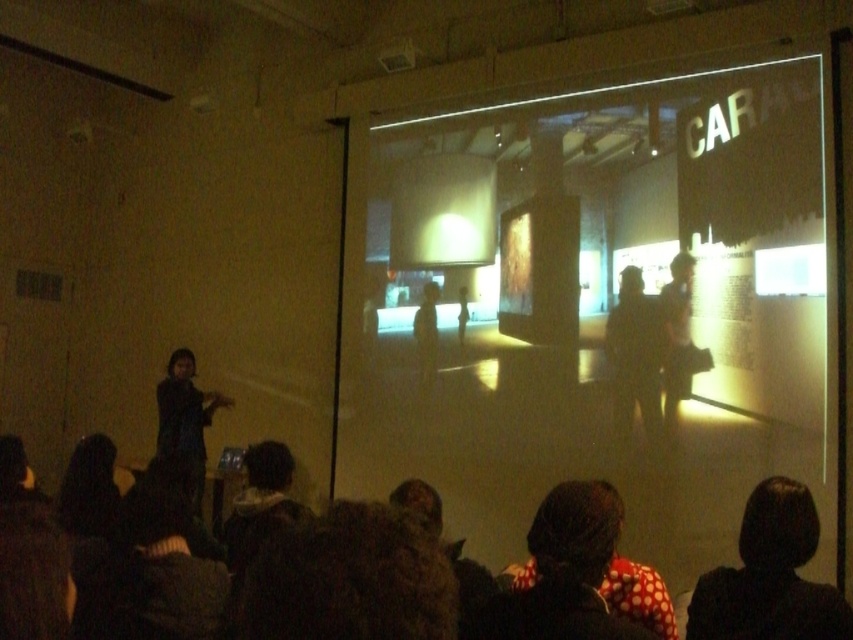
How far apart are dark fabric dress at left and dark fabric bag at center?

dark fabric dress at left is 3.33 meters away from dark fabric bag at center.

Which is more to the right, dark fabric dress at left or dark fabric bag at center?

dark fabric bag at center

Is point (169, 413) positioned before point (683, 353)?

That is False.

Locate an element on the screen. The height and width of the screenshot is (640, 853). dark fabric dress at left is located at coordinates (184, 419).

Is dark fabric jacket at center in front of dark fabric dress at left?

Yes, it is.

Can you confirm if dark fabric jacket at center is taller than dark fabric dress at left?

Indeed, dark fabric jacket at center has a greater height compared to dark fabric dress at left.

Does point (631, 268) come in front of point (183, 380)?

Yes.

Locate an element on the screen. dark fabric jacket at center is located at coordinates (634, 355).

Does dark hair at lower right appear on the left side of dark fabric jacket at center?

Correct, you'll find dark hair at lower right to the left of dark fabric jacket at center.

Find the location of a particular element. Image resolution: width=853 pixels, height=640 pixels. dark hair at lower right is located at coordinates (770, 576).

Who is more distant from viewer, (776, 588) or (619, 289)?

Positioned behind is point (619, 289).

What are the coordinates of `dark hair at lower right` in the screenshot? It's located at (770, 576).